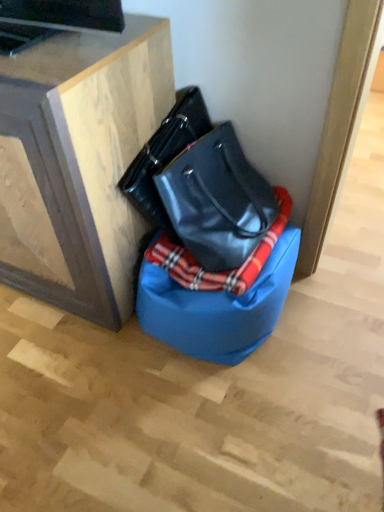
Question: In terms of height, does glossy black handbag at center look taller or shorter compared to wooden cabinet at upper left?

Choices:
 (A) tall
 (B) short

Answer: (B)

Question: From a real-world perspective, is glossy black handbag at center positioned above or below wooden cabinet at upper left?

Choices:
 (A) below
 (B) above

Answer: (B)

Question: Considering the real-world distances, which object is closest to the wooden cabinet at upper left?

Choices:
 (A) glossy black handbag at center
 (B) plaid fabric blanket at center
 (C) blue fabric bean bag chair at lower center

Answer: (A)

Question: Which object is positioned farthest from the plaid fabric blanket at center?

Choices:
 (A) glossy black handbag at center
 (B) wooden cabinet at upper left
 (C) blue fabric bean bag chair at lower center

Answer: (B)